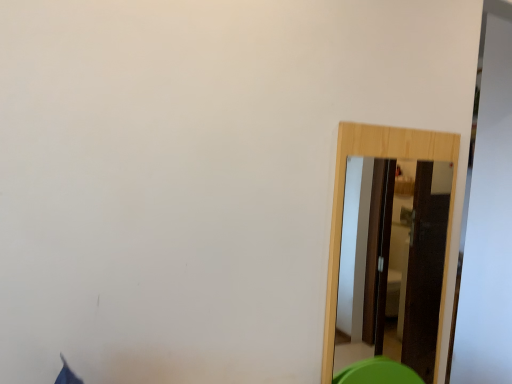
Locate an element on the screen. This screenshot has width=512, height=384. wooden mirror at right is located at coordinates (343, 204).

The image size is (512, 384). What do you see at coordinates (343, 204) in the screenshot?
I see `wooden mirror at right` at bounding box center [343, 204].

In order to click on wooden mirror at right in this screenshot , I will do `click(343, 204)`.